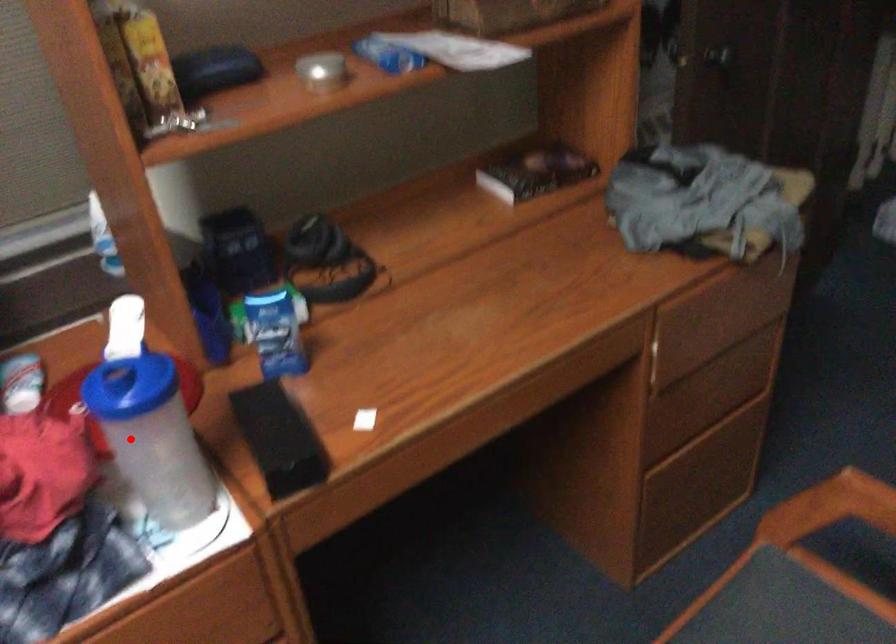
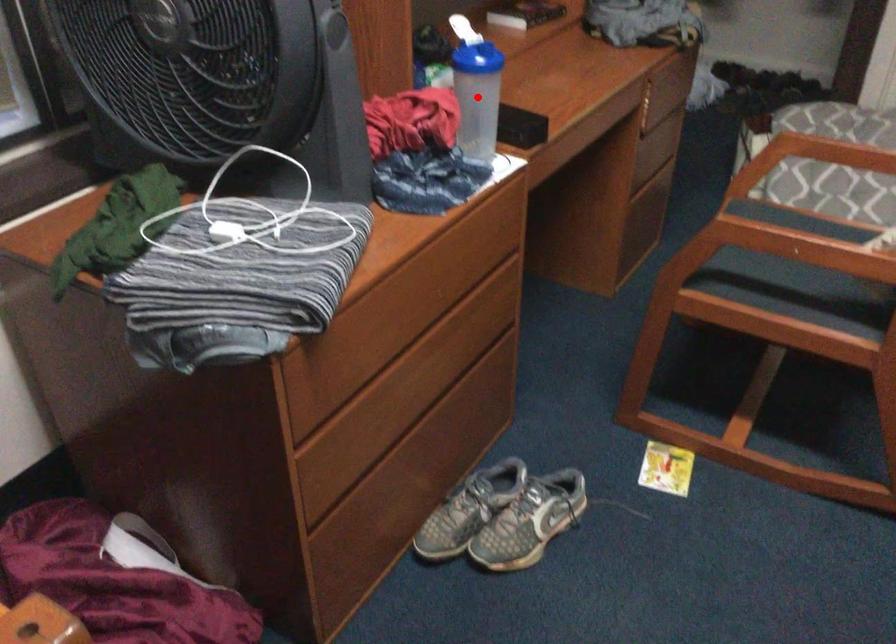
I am providing you with two images of the same scene from different viewpoints. A red point is marked on the first image and another point is marked on the second image. Is the marked point in image1 the same physical position as the marked point in image2?

Yes